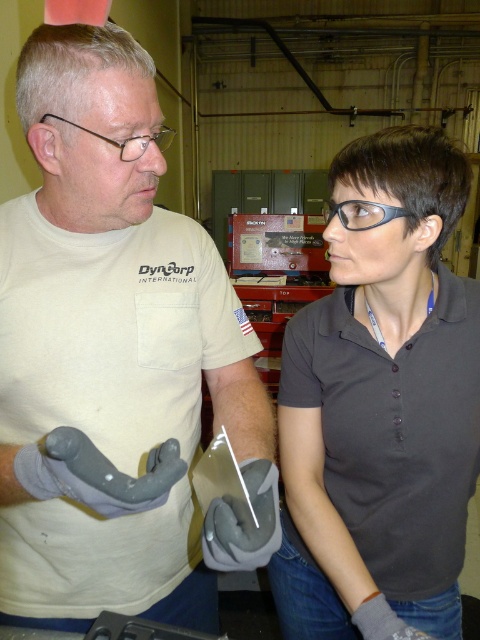
Question: Based on their relative distances, which object is farther from the dark gray matte shirt at center?

Choices:
 (A) black plastic glasses at center
 (B) clear plastic glasses at upper left
 (C) gray rubber gloves at center

Answer: (B)

Question: Can you confirm if black plastic glasses at center is thinner than clear plastic glasses at upper left?

Choices:
 (A) yes
 (B) no

Answer: (A)

Question: Which point appears farthest from the camera in this image?

Choices:
 (A) (410, 486)
 (B) (381, 212)
 (C) (153, 138)

Answer: (A)

Question: Is gray rubber gloves at center smaller than clear plastic glasses at upper left?

Choices:
 (A) no
 (B) yes

Answer: (B)

Question: Based on their relative distances, which object is nearer to the clear plastic glasses at upper left?

Choices:
 (A) dark gray matte shirt at center
 (B) gray rubber gloves at center

Answer: (B)

Question: Does dark gray matte shirt at center appear over clear plastic glasses at upper left?

Choices:
 (A) yes
 (B) no

Answer: (B)